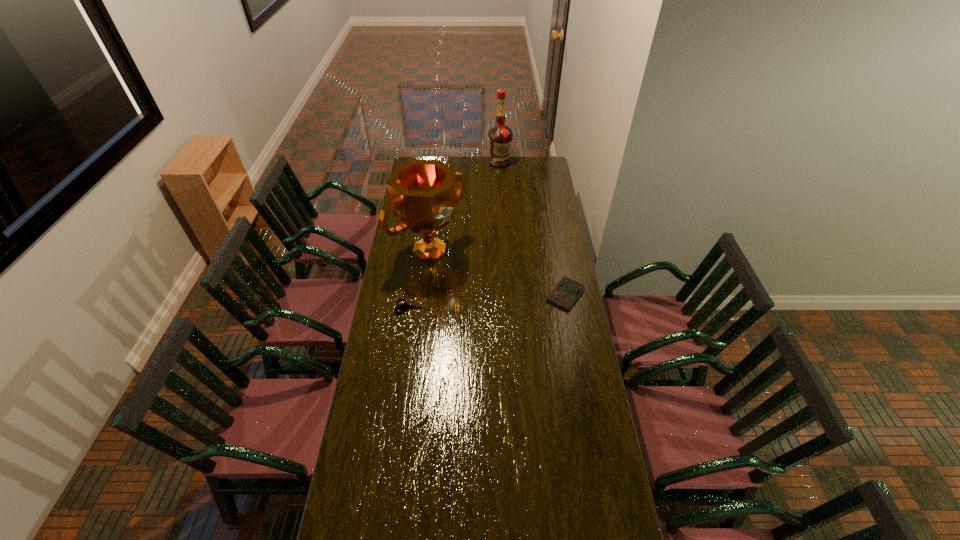
I want to click on vacant space situated on the front and back of the third object from left to right, so click(500, 191).

Where is `vacant space located 0.240m on the side of the second farthest object with the star emblem`? vacant space located 0.240m on the side of the second farthest object with the star emblem is located at coordinates (485, 294).

The height and width of the screenshot is (540, 960). What are the coordinates of `vacant space located on the side of the second farthest object with the star emblem` in the screenshot? It's located at (478, 288).

The image size is (960, 540). Identify the location of free region located on the side of the second farthest object with the star emblem. (492, 300).

Identify the location of object at the far edge. (500, 136).

You are a GUI agent. You are given a task and a screenshot of the screen. Output one action in this format:
    pyautogui.click(x=<x>, y=<y>)
    Task: Click on the shears positioned at the left edge
    The height and width of the screenshot is (540, 960).
    Given the screenshot: What is the action you would take?
    pyautogui.click(x=404, y=306)

Where is `award at the left edge`? award at the left edge is located at coordinates (422, 193).

The height and width of the screenshot is (540, 960). I want to click on object that is positioned at the right edge, so click(567, 291).

In the image, there is a desktop. Find the location of `vacant space at the far edge`. vacant space at the far edge is located at coordinates (456, 162).

Identify the location of vacant space at the left edge of the desktop. Image resolution: width=960 pixels, height=540 pixels. (409, 231).